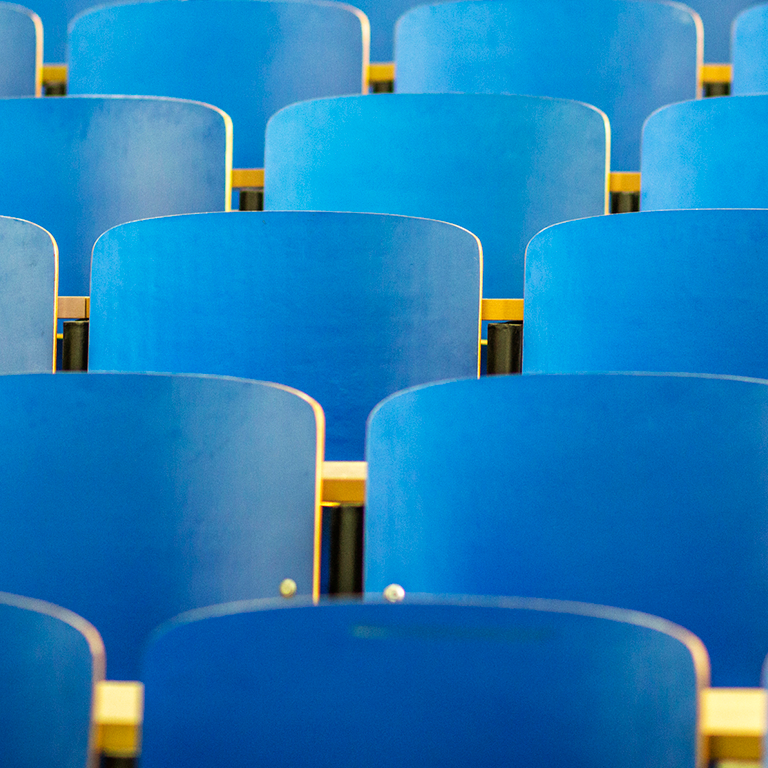
Image resolution: width=768 pixels, height=768 pixels. I want to click on spaces between chairs, so click(x=116, y=649), click(x=339, y=531), click(x=706, y=38), click(x=373, y=50), click(x=54, y=38), click(x=253, y=169), click(x=634, y=170), click(x=504, y=292), click(x=68, y=266).